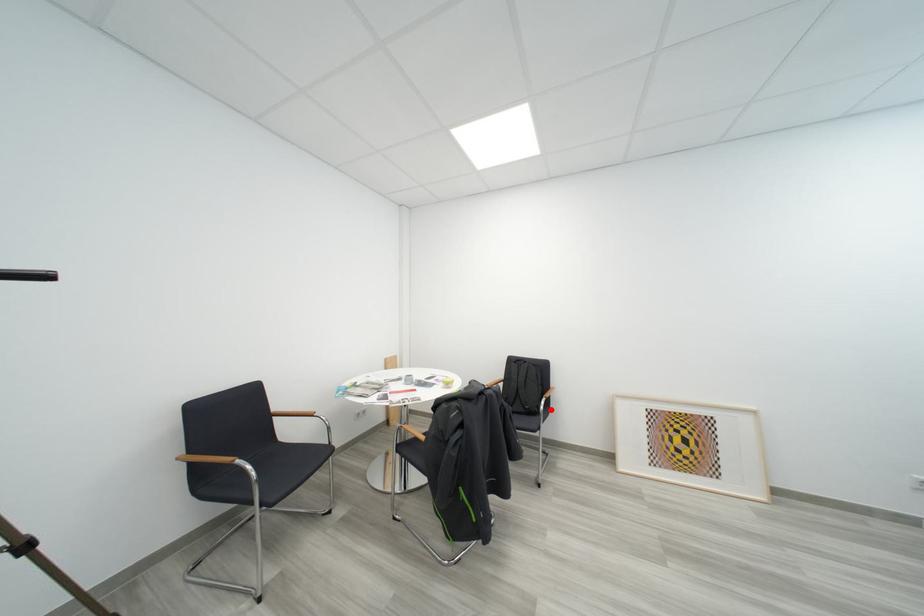
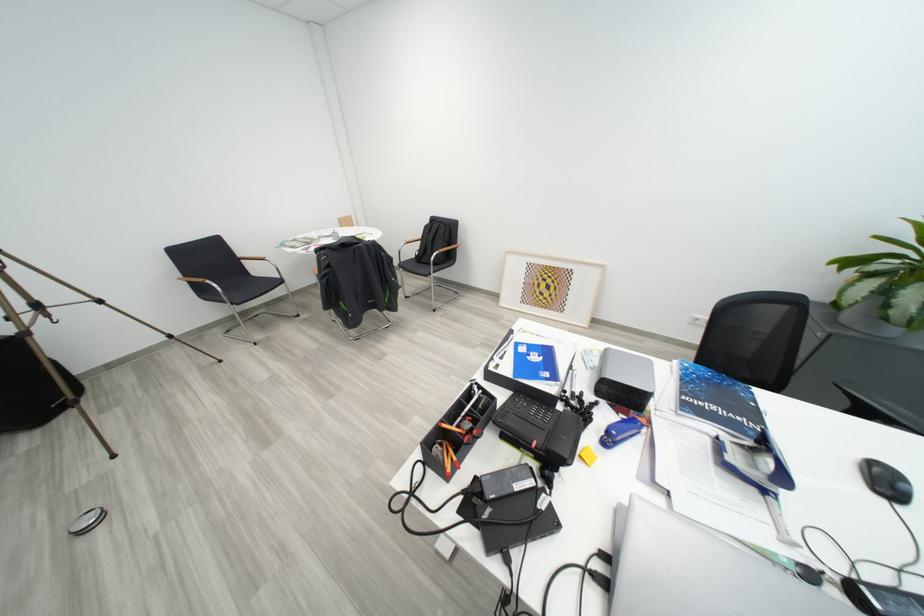
Locate, in the second image, the point that corresponds to the highlighted location in the first image.

(442, 262)